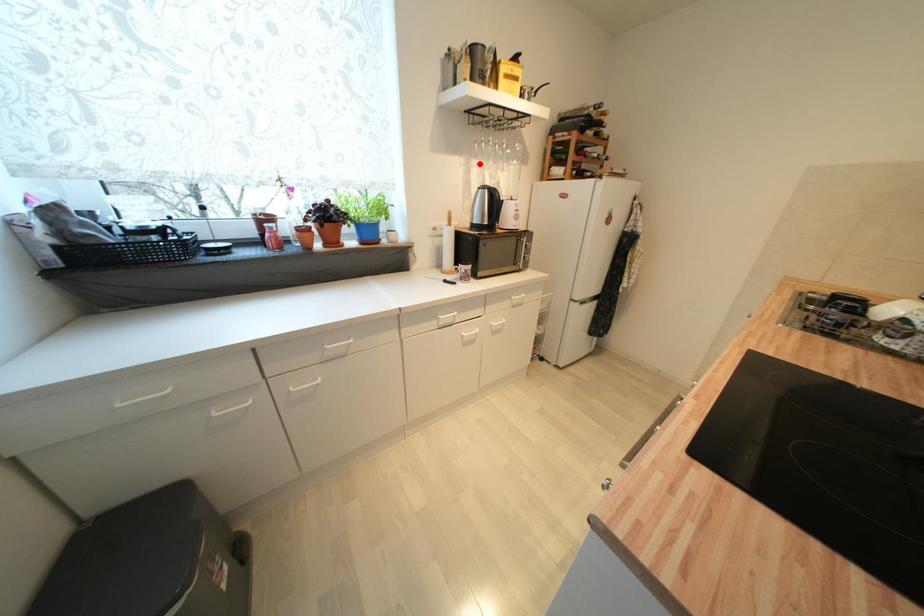
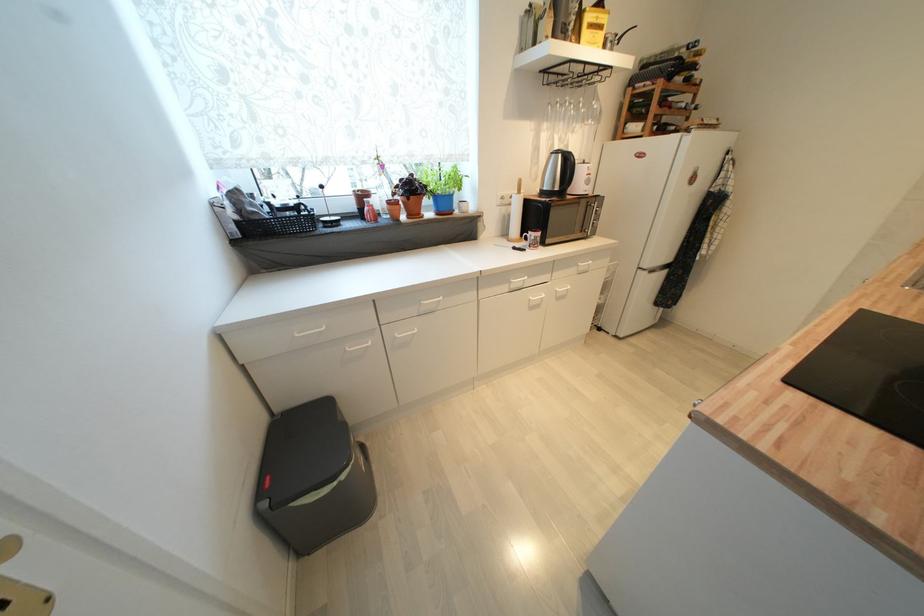
The point at the highlighted location is marked in the first image. Where is the corresponding point in the second image?

(551, 127)